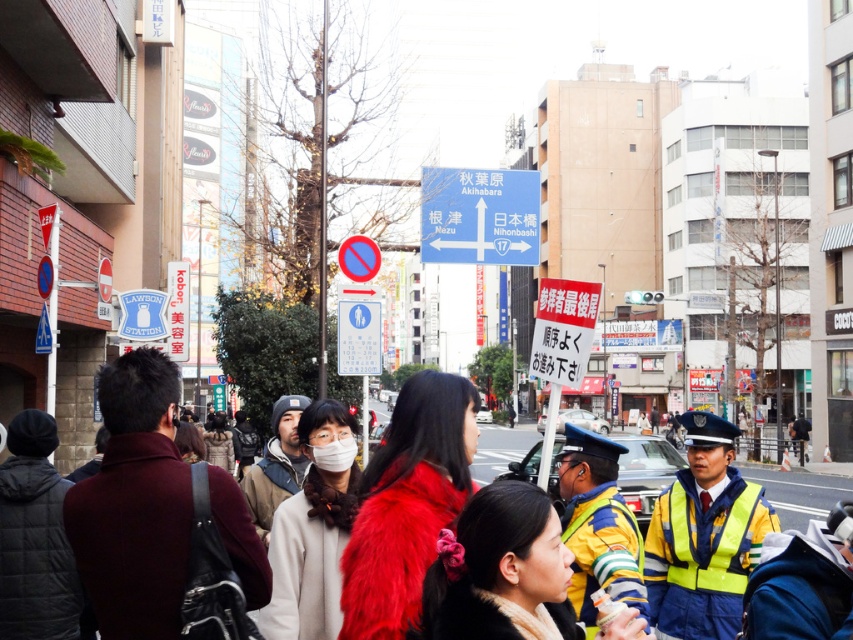
Question: Does blue plastic sign at upper center have a smaller size compared to white matte mask at center?

Choices:
 (A) no
 (B) yes

Answer: (A)

Question: Which of these objects is positioned farthest from the red fur coat at center?

Choices:
 (A) white matte mask at center
 (B) yellow reflective vest at center
 (C) maroon sweater at left
 (D) blue plastic sign at upper center

Answer: (B)

Question: Which is farther from the white matte mask at center?

Choices:
 (A) yellow reflective vest at right
 (B) maroon sweater at left
 (C) blue plastic sign at upper center

Answer: (C)

Question: Is the position of maroon sweater at left more distant than that of yellow reflective vest at center?

Choices:
 (A) no
 (B) yes

Answer: (B)

Question: Does yellow reflective vest at right lie behind red fur coat at center?

Choices:
 (A) yes
 (B) no

Answer: (A)

Question: Based on their relative distances, which object is farther from the yellow reflective vest at center?

Choices:
 (A) red fur coat at center
 (B) maroon sweater at left
 (C) white matte mask at center
 (D) blue plastic sign at upper center

Answer: (A)